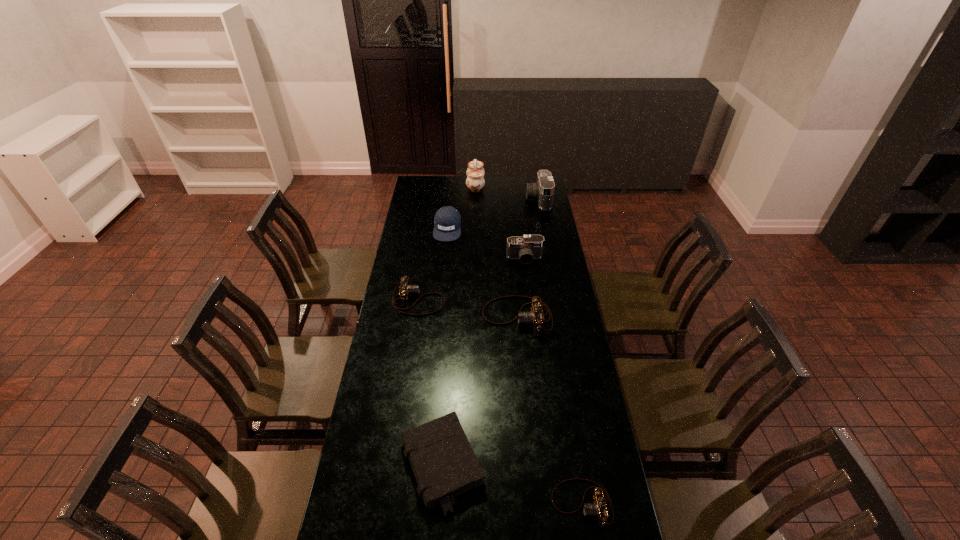
At what (x,y) coordinates should I click in order to perform the action: click on free space between the sixth nearest object and the nearest brown camera. Please return your answer as a coordinate pair (x, y). Image resolution: width=960 pixels, height=540 pixels. Looking at the image, I should click on (515, 366).

Locate an element on the screen. The image size is (960, 540). vacant area that lies between the Bible and the fourth tallest camera is located at coordinates (431, 383).

At what (x,y) coordinates should I click in order to perform the action: click on free spot between the leftmost brown camera and the biggest brown camera. Please return your answer as a coordinate pair (x, y). The image size is (960, 540). Looking at the image, I should click on pos(468,309).

Find the location of a particular element. This screenshot has width=960, height=540. free spot between the shortest camera and the biggest brown camera is located at coordinates (549, 410).

You are a GUI agent. You are given a task and a screenshot of the screen. Output one action in this format:
    pyautogui.click(x=<x>, y=<y>)
    Task: Click on the vacant area that lies between the tallest camera and the blue baseball cap
    This screenshot has width=960, height=540.
    Given the screenshot: What is the action you would take?
    (492, 214)

Identify the location of blank region between the second tallest camera and the leftmost camera. (471, 279).

Locate an element on the screen. Image resolution: width=960 pixels, height=540 pixels. object that is the sixth closest to the white chinaware is located at coordinates (443, 462).

Identify which object is the fifth nearest to the biggest brown camera. Please provide its 2D coordinates. Your answer should be formatted as a tuple, i.e. [(x, y)], where the tuple contains the x and y coordinates of a point satisfying the conditions above.

[(597, 509)]

Choose which camera is the fifth nearest neighbor to the sixth nearest object. Please provide its 2D coordinates. Your answer should be formatted as a tuple, i.e. [(x, y)], where the tuple contains the x and y coordinates of a point satisfying the conditions above.

[(597, 509)]

Where is `camera that is the second closest to the seventh shortest object`? This screenshot has height=540, width=960. camera that is the second closest to the seventh shortest object is located at coordinates (535, 318).